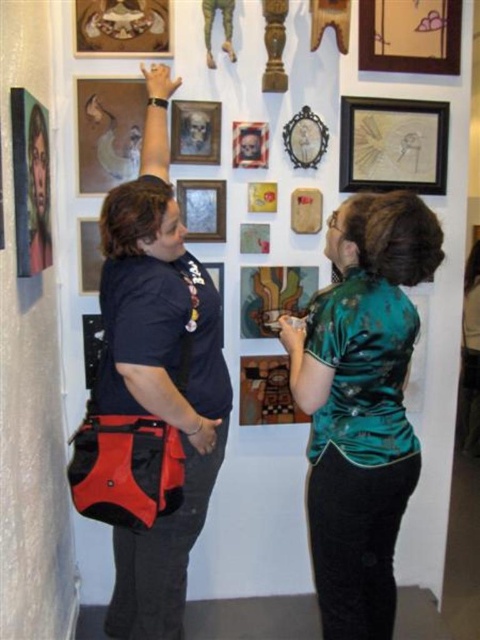
Is matte black shirt at upper left below wooden picture frame at center?

Yes, matte black shirt at upper left is below wooden picture frame at center.

Is point (200, 529) less distant than point (213, 269)?

Yes, it is in front of point (213, 269).

Image resolution: width=480 pixels, height=640 pixels. What are the coordinates of `matte black shirt at upper left` in the screenshot? It's located at point(158,371).

Is point (394, 410) more distant than point (90, 288)?

No, (394, 410) is in front of (90, 288).

Consider the image. Between teal satin blouse at upper center and matte black picture frame at upper left, which one appears on the left side from the viewer's perspective?

matte black picture frame at upper left is more to the left.

Who is more distant from viewer, (336, 611) or (94, 264)?

The point (94, 264) is more distant.

This screenshot has height=640, width=480. Find the location of `teal satin blouse at upper center`. teal satin blouse at upper center is located at coordinates (361, 404).

Is wooden picture frame at upper center behind wooden skull at upper center?

No, wooden picture frame at upper center is closer to the viewer.

Looking at this image, is wooden picture frame at upper center thinner than wooden skull at upper center?

No, wooden picture frame at upper center is not thinner than wooden skull at upper center.

Locate an element on the screen. wooden picture frame at upper center is located at coordinates (x=203, y=209).